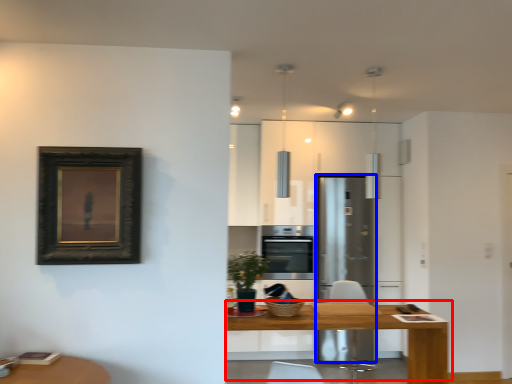
Question: Among these objects, which one is farthest to the camera, table (highlighted by a red box) or fridge (highlighted by a blue box)?

Choices:
 (A) table
 (B) fridge

Answer: (B)